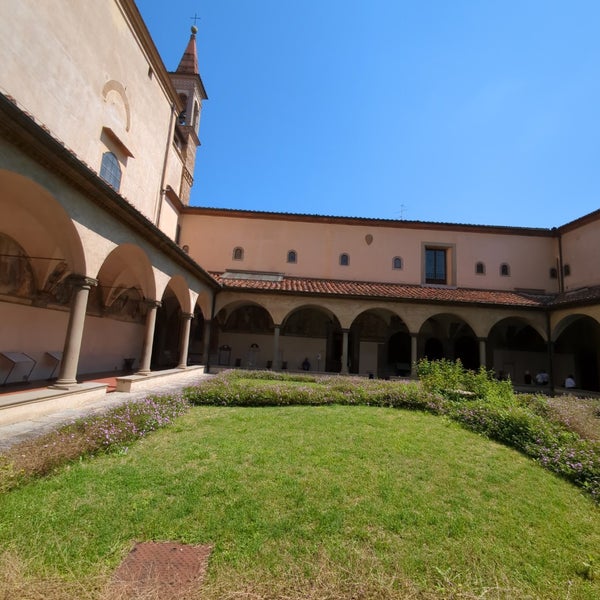
Identify the location of window. (437, 269).